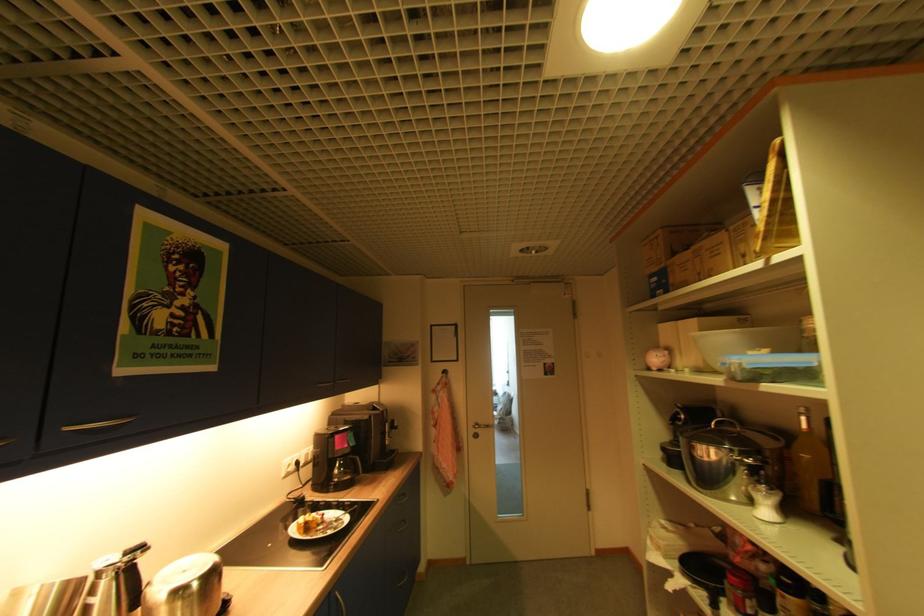
Where would you lift the plastic food container? Please return your answer as a coordinate pair (x, y).

(745, 342)